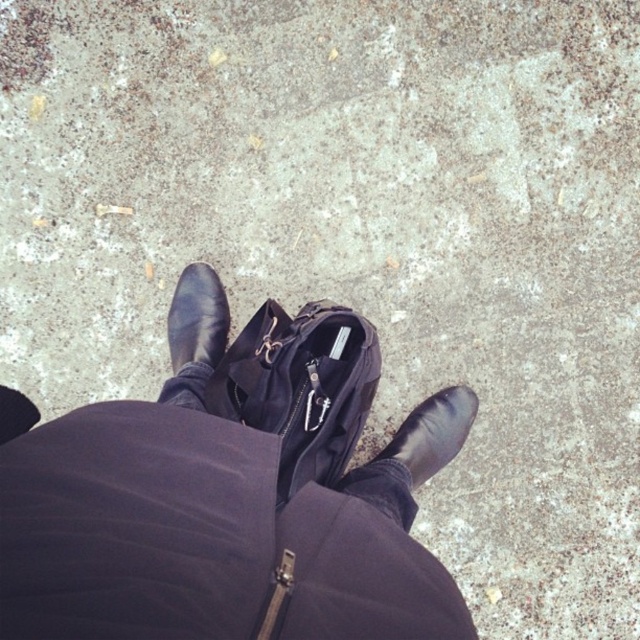
Based on the photo, who is more distant from viewer, (237, 612) or (464, 435)?

Point (464, 435)

The image size is (640, 640). In order to click on black leather shoes at center in this screenshot , I will do `click(228, 500)`.

Where is `black leather shoes at center`? black leather shoes at center is located at coordinates (228, 500).

Is point (305, 317) positioned behind point (202, 353)?

No.

The image size is (640, 640). I want to click on black leather shoes at center, so (x=228, y=500).

In order to click on black leather shoes at center in this screenshot , I will do `click(228, 500)`.

Can you confirm if black leather shoe at lower center is positioned to the right of black leather shoe at center?

Indeed, black leather shoe at lower center is positioned on the right side of black leather shoe at center.

Does black leather shoe at lower center appear under black leather shoe at center?

Indeed, black leather shoe at lower center is positioned under black leather shoe at center.

Image resolution: width=640 pixels, height=640 pixels. What do you see at coordinates (433, 433) in the screenshot?
I see `black leather shoe at lower center` at bounding box center [433, 433].

Locate an element on the screen. black leather shoe at lower center is located at coordinates (433, 433).